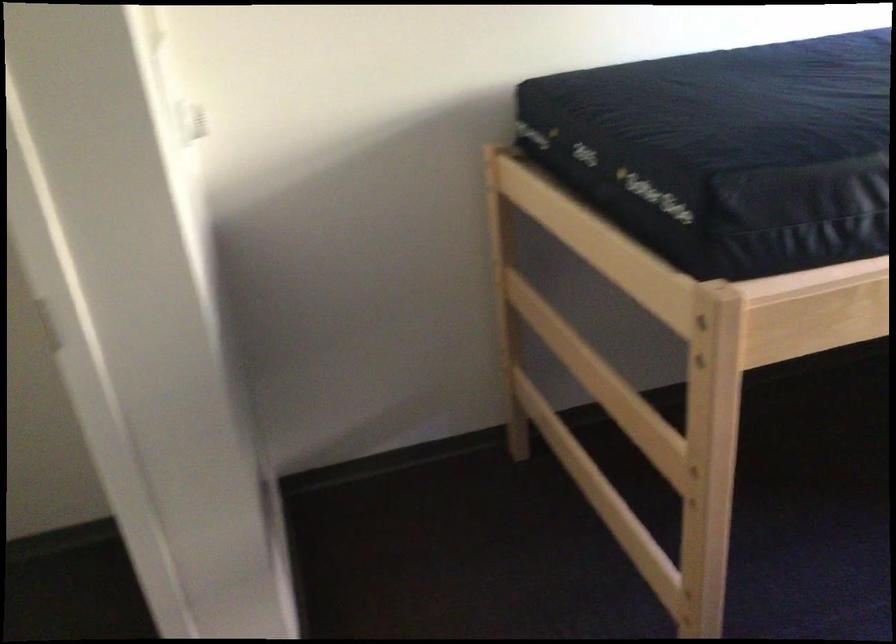
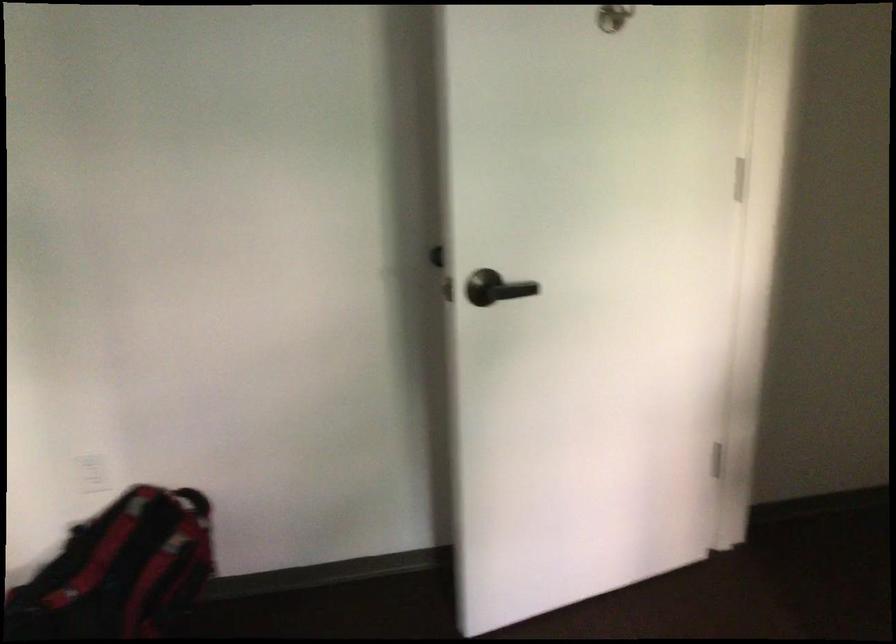
Based on the continuous images, in which direction is the camera rotating?

The camera rotated toward left-down.